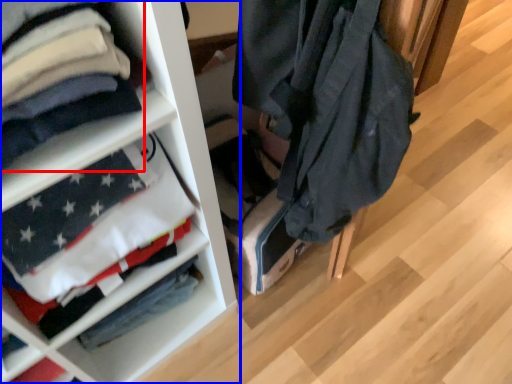
Question: Which object appears farthest to the camera in this image, cloak (highlighted by a red box) or shelf (highlighted by a blue box)?

Choices:
 (A) cloak
 (B) shelf

Answer: (B)